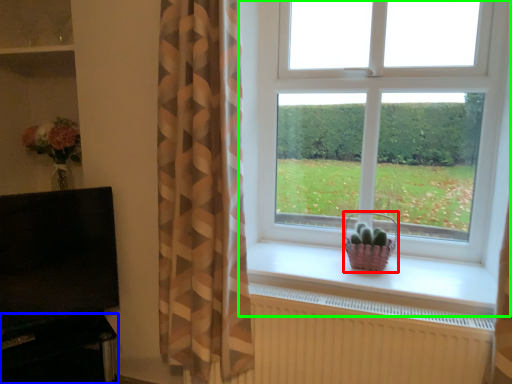
Question: Which object is positioned farthest from basket (highlighted by a red box)? Select from entertainment center (highlighted by a blue box) and window (highlighted by a green box).

Choices:
 (A) entertainment center
 (B) window

Answer: (A)